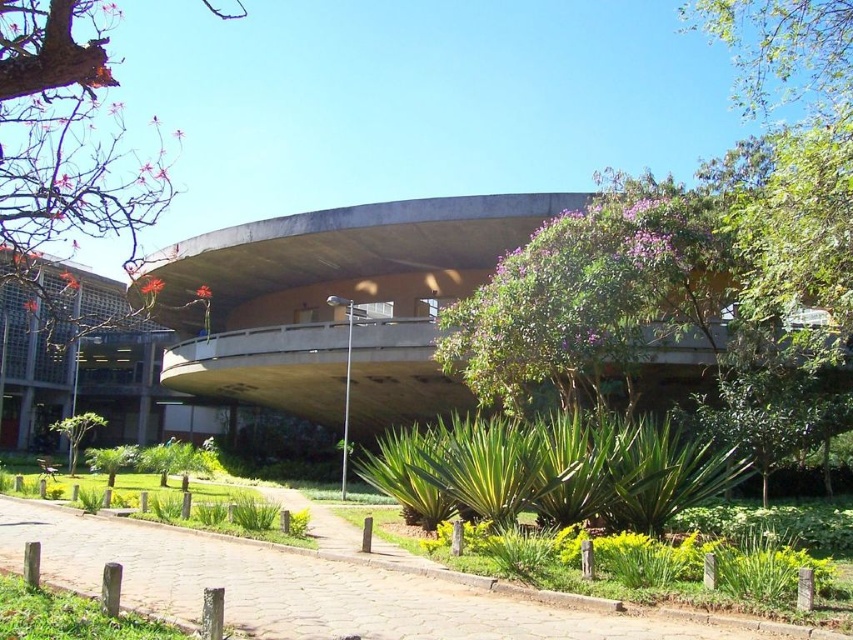
You are an architect planning to add a new tree to the garden. The new tree will be placed between the smooth bark tree at left and the green leafy tree at lower left. Considering their sizes, which existing tree should the new tree be closer to in order to maintain visual balance?

The smooth bark tree at left is bigger than the green leafy tree at lower left. To maintain visual balance, the new tree should be placed closer to the green leafy tree at lower left so that the combined sizes create equilibrium between both sides.